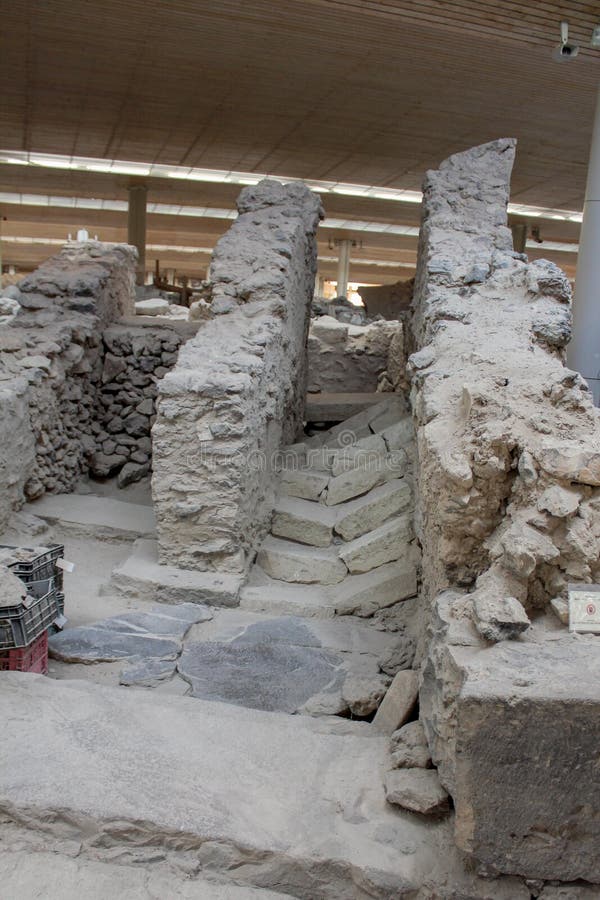
Locate an element on the screen. column is located at coordinates (138, 223).